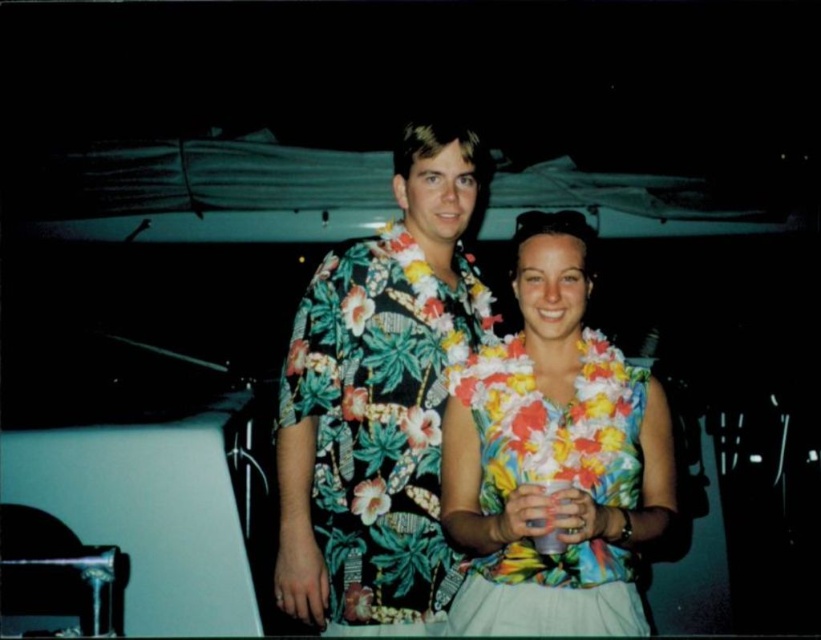
Can you confirm if floral fabric lei at center is positioned to the left of translucent plastic cup at center?

In fact, floral fabric lei at center is to the right of translucent plastic cup at center.

This screenshot has height=640, width=821. What do you see at coordinates (553, 458) in the screenshot?
I see `floral fabric lei at center` at bounding box center [553, 458].

Which is in front, point (613, 589) or point (556, 488)?

Positioned in front is point (556, 488).

The image size is (821, 640). Find the location of `floral fabric lei at center`. floral fabric lei at center is located at coordinates (553, 458).

Does floral print shirt at center appear on the left side of translucent plastic cup at center?

Indeed, floral print shirt at center is positioned on the left side of translucent plastic cup at center.

Between floral print shirt at center and translucent plastic cup at center, which one is positioned lower?

translucent plastic cup at center is lower down.

This screenshot has width=821, height=640. I want to click on floral print shirt at center, so click(x=379, y=400).

Locate an element on the screen. The height and width of the screenshot is (640, 821). floral print shirt at center is located at coordinates (379, 400).

Does floral print shirt at center have a smaller size compared to floral fabric lei at center?

No.

Which is in front, point (407, 596) or point (555, 604)?

Point (555, 604)

At what (x,y) coordinates should I click in order to perform the action: click on floral print shirt at center. Please return your answer as a coordinate pair (x, y). Looking at the image, I should click on (379, 400).

The image size is (821, 640). I want to click on floral print shirt at center, so click(379, 400).